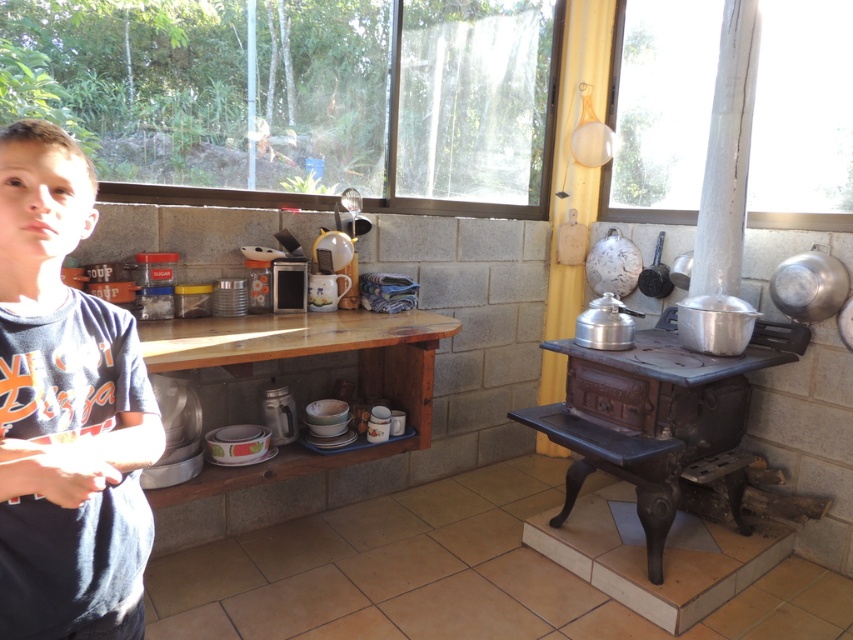
Can you confirm if transparent glass window at upper right is positioned to the left of rustic cast iron stove at right?

Incorrect, transparent glass window at upper right is not on the left side of rustic cast iron stove at right.

Is transparent glass window at upper right below rustic cast iron stove at right?

Actually, transparent glass window at upper right is above rustic cast iron stove at right.

The image size is (853, 640). Describe the element at coordinates (802, 116) in the screenshot. I see `transparent glass window at upper right` at that location.

This screenshot has width=853, height=640. Find the location of `transparent glass window at upper right`. transparent glass window at upper right is located at coordinates (802, 116).

Between point (252, 38) and point (816, 65), which one is positioned in front?

Point (252, 38) is more forward.

Locate an element on the screen. This screenshot has width=853, height=640. transparent glass window at upper center is located at coordinates (297, 97).

This screenshot has height=640, width=853. What are the coordinates of `transparent glass window at upper center` in the screenshot? It's located at (297, 97).

Is transparent glass window at upper center below dark blue t-shirt at left?

No.

Between transparent glass window at upper center and dark blue t-shirt at left, which one appears on the left side from the viewer's perspective?

From the viewer's perspective, dark blue t-shirt at left appears more on the left side.

What are the coordinates of `transparent glass window at upper center` in the screenshot? It's located at (297, 97).

This screenshot has height=640, width=853. I want to click on transparent glass window at upper center, so click(297, 97).